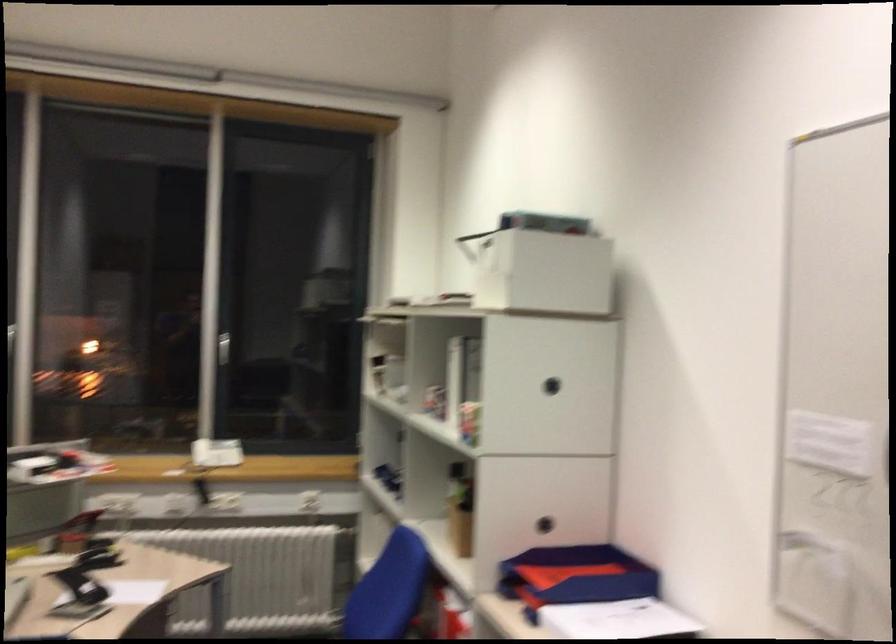
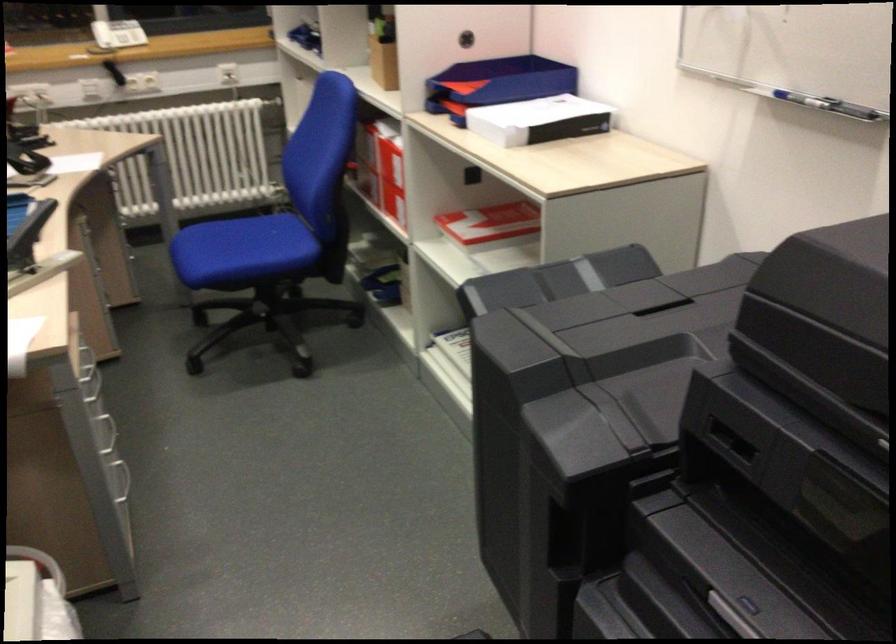
The point at [211,446] is marked in the first image. Where is the corresponding point in the second image?

(117, 33)